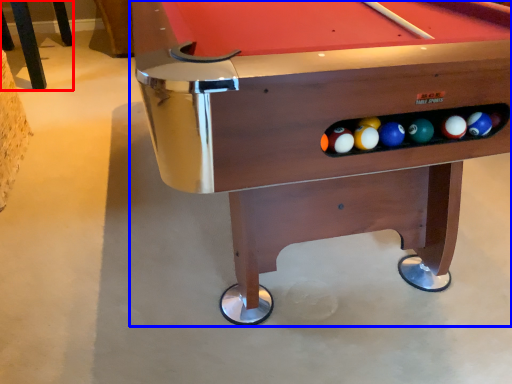
Question: Which object is closer to the camera taking this photo, furniture (highlighted by a red box) or billiard table (highlighted by a blue box)?

Choices:
 (A) furniture
 (B) billiard table

Answer: (B)